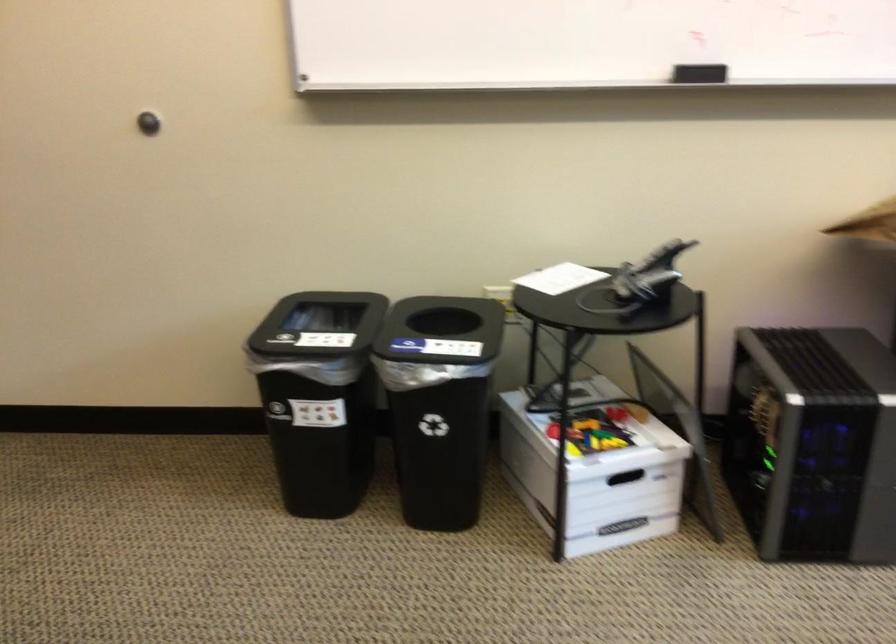
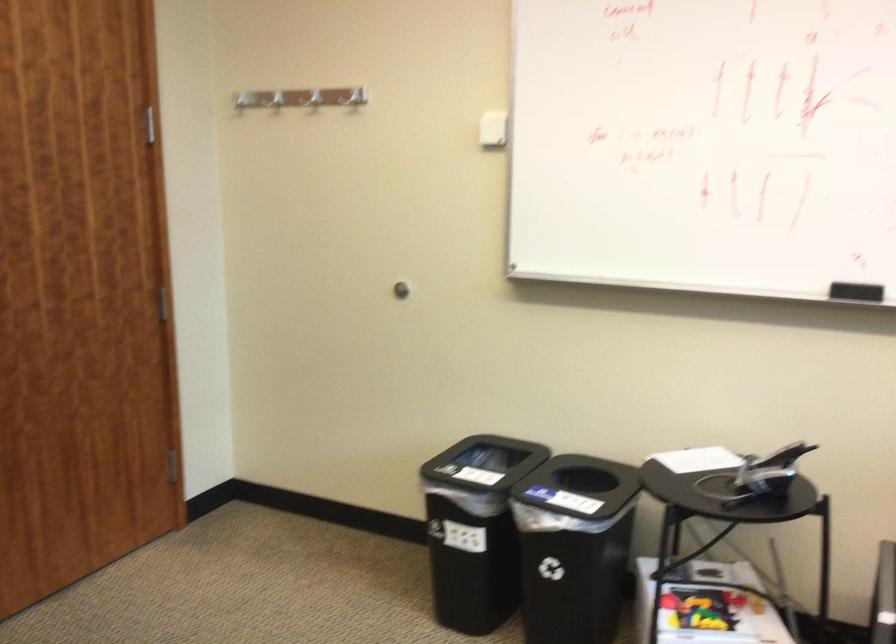
Find the pixel in the second image that matches (460,397) in the first image.

(574, 547)